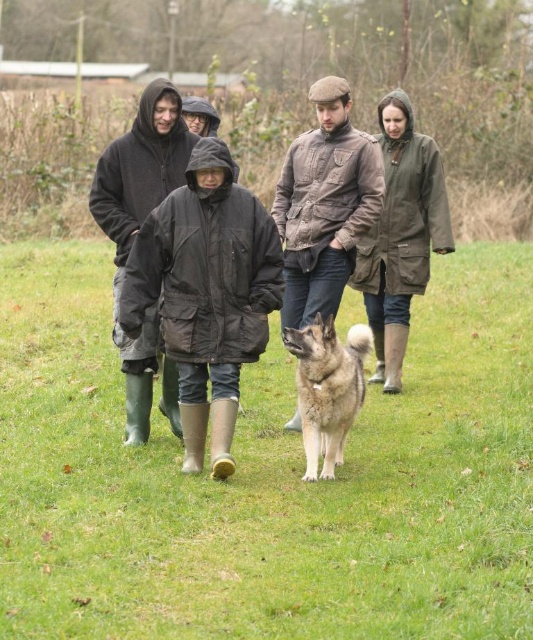
You are organizing a group hike and need to ensure that all participants have jackets that fit through a narrow trail passage. The passage has a width limit of 1.2 meters. Given that the black waterproof jacket at center and the matte black jacket at center are both worn by hikers, which jacket might pose a problem due to its width?

The black waterproof jacket at center has a larger width than the matte black jacket at center, so it might pose a problem as it may exceed the 1.2 meters width limit of the trail passage.

You are a photographer trying to capture a photo of the matte black jacket at center and the brown fur dog at center. If you want to ensure both subjects are in focus, which one should you focus on first considering their heights?

The matte black jacket at center is taller than the brown fur dog at center, so you should focus on the matte black jacket at center first to ensure both are in focus.